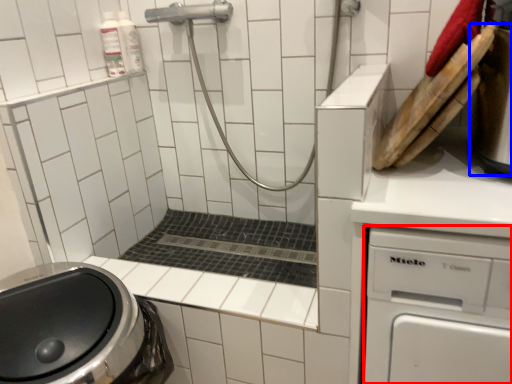
Question: Which point is closer to the camera, dish washer (highlighted by a red box) or appliance (highlighted by a blue box)?

Choices:
 (A) dish washer
 (B) appliance

Answer: (A)